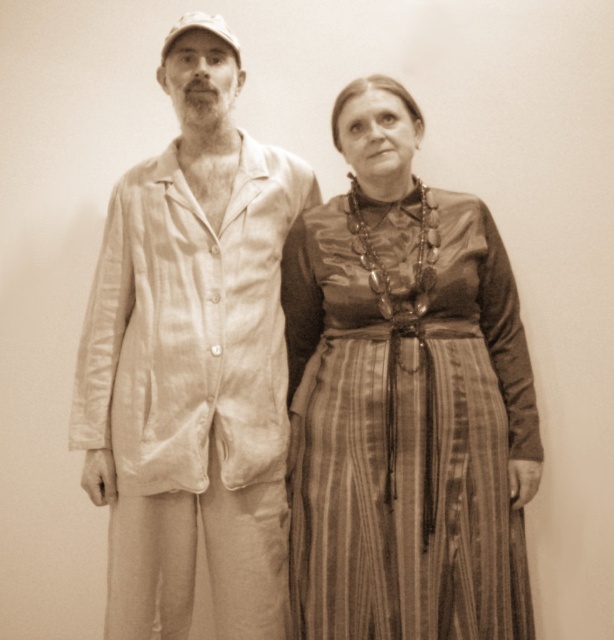
You are a photographer who needs to capture a closeup shot of both the striped silk dress at center and the light beige cotton pajamas at left. Given that your camera has a maximum focus range of 8 inches, will you be able to capture both items in focus without adjusting your camera settings?

The striped silk dress at center and light beige cotton pajamas at left are 9.37 inches apart. Since the distance between them exceeds the camera maximum focus range of 8 inches, you will need to adjust your camera settings to ensure both items are in focus.